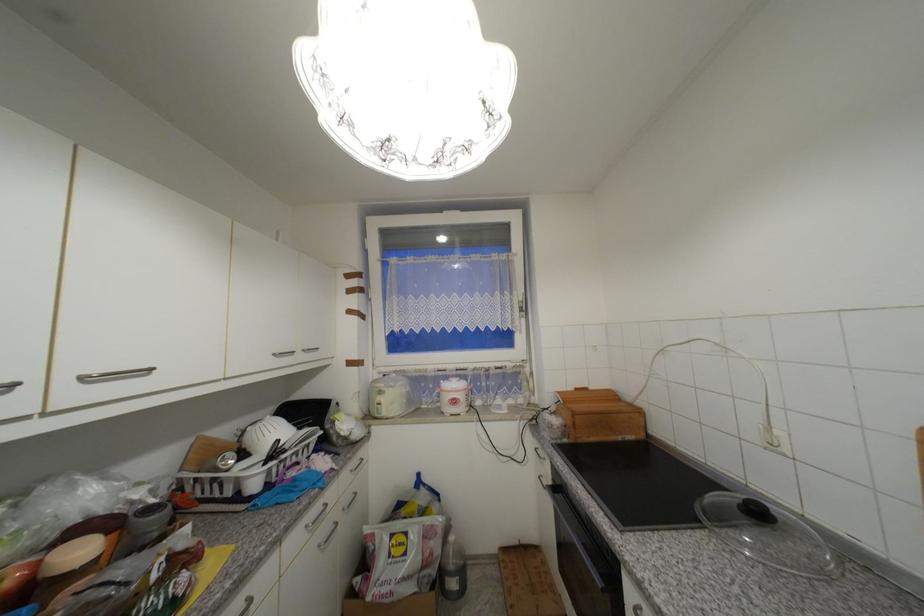
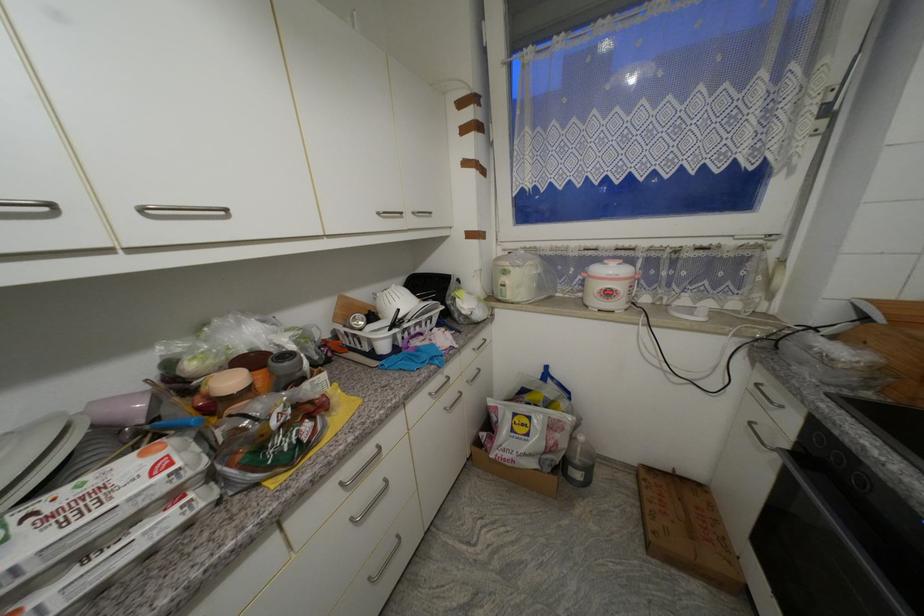
The point at (459, 403) is marked in the first image. Where is the corresponding point in the second image?

(614, 294)